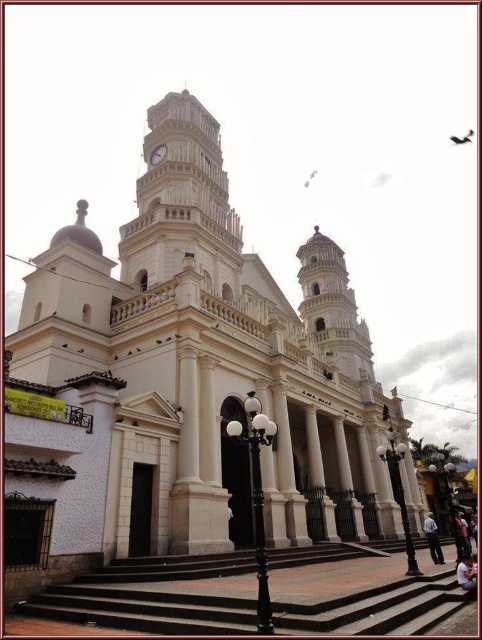
Consider the image. Is polished brass lamp post at lower right taller than gold metallic clock at upper center?

Indeed, polished brass lamp post at lower right has a greater height compared to gold metallic clock at upper center.

Between polished brass lamp post at lower right and gold metallic clock at upper center, which one has more height?

polished brass lamp post at lower right

Image resolution: width=482 pixels, height=640 pixels. What do you see at coordinates (399, 492) in the screenshot?
I see `polished brass lamp post at lower right` at bounding box center [399, 492].

The width and height of the screenshot is (482, 640). What are the coordinates of `polished brass lamp post at lower right` in the screenshot? It's located at (399, 492).

Who is positioned more to the right, white stone church at center or white stone clock tower at upper left?

From the viewer's perspective, white stone church at center appears more on the right side.

Measure the distance between point [311,433] and camera.

75.71 meters

This screenshot has height=640, width=482. I want to click on white stone church at center, so click(189, 381).

Can you confirm if white stone clock tower at upper left is positioned above polished brass lamp post at lower right?

Yes.

This screenshot has width=482, height=640. I want to click on white stone clock tower at upper left, so click(x=183, y=202).

Is point (211, 161) in front of point (396, 490)?

No, it is not.

Identify the location of white stone clock tower at upper left. (183, 202).